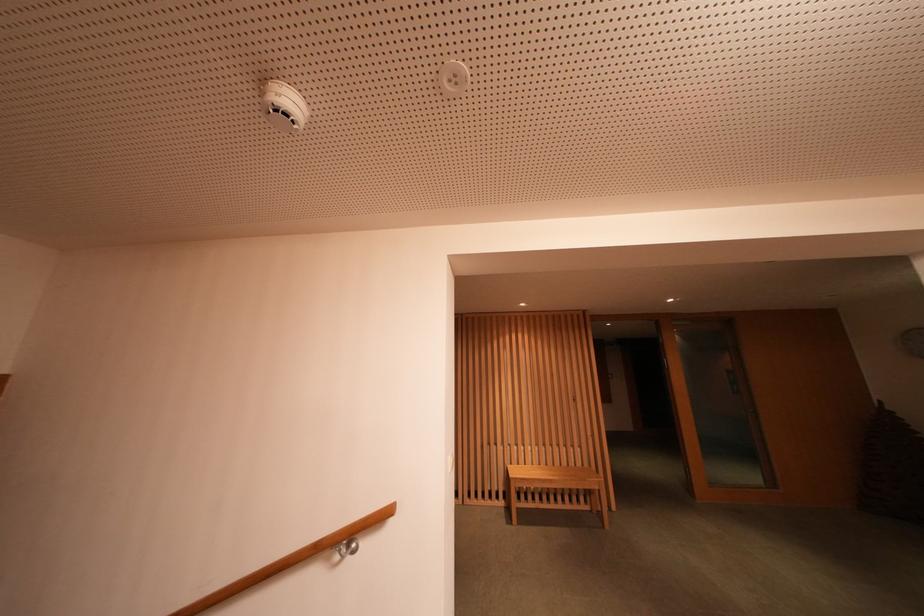
Describe the element at coordinates (553, 475) in the screenshot. This screenshot has width=924, height=616. I see `the chair sitting surface` at that location.